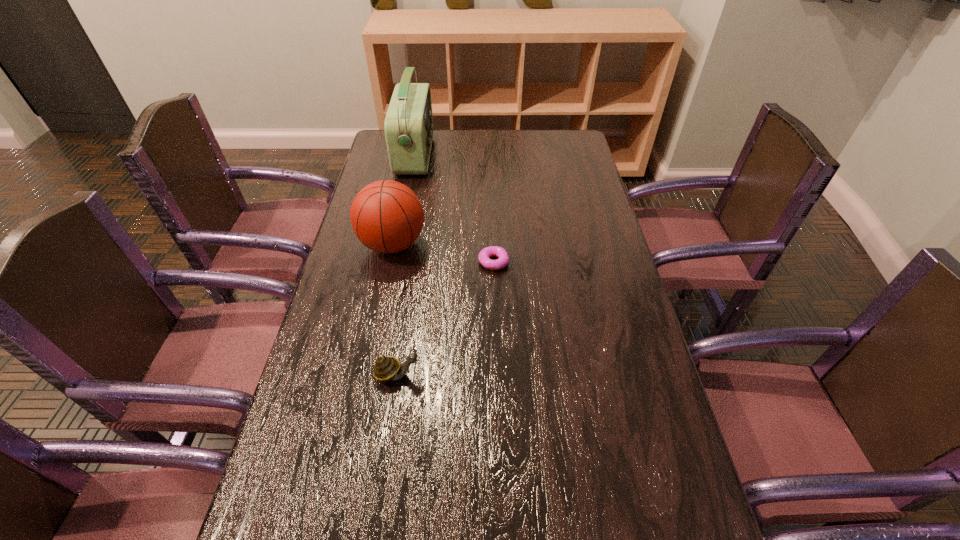
At what (x,y) coordinates should I click in order to perform the action: click on blank region between the doughnut and the basketball. Please return your answer as a coordinate pair (x, y). The width and height of the screenshot is (960, 540). Looking at the image, I should click on (444, 253).

The height and width of the screenshot is (540, 960). Identify the location of blank region between the rightmost object and the radio receiver. (454, 209).

You are a GUI agent. You are given a task and a screenshot of the screen. Output one action in this format:
    pyautogui.click(x=<x>, y=<y>)
    Task: Click on the blank region between the snail and the third shortest object
    Image resolution: width=960 pixels, height=540 pixels.
    Given the screenshot: What is the action you would take?
    pyautogui.click(x=396, y=309)

Image resolution: width=960 pixels, height=540 pixels. I want to click on empty space that is in between the second tallest object and the rightmost object, so click(x=444, y=253).

Identify the location of unoccupied area between the second tallest object and the nearest object. (396, 309).

At what (x,y) coordinates should I click in order to perform the action: click on free space between the nearest object and the third shortest object. Please return your answer as a coordinate pair (x, y). The height and width of the screenshot is (540, 960). Looking at the image, I should click on (396, 309).

You are a GUI agent. You are given a task and a screenshot of the screen. Output one action in this format:
    pyautogui.click(x=<x>, y=<y>)
    Task: Click on the empty space that is in between the third shortest object and the second shortest object
    Image resolution: width=960 pixels, height=540 pixels.
    Given the screenshot: What is the action you would take?
    pyautogui.click(x=396, y=309)

Identify the location of vacant area that lies between the radio receiver and the doughnut. This screenshot has height=540, width=960. (454, 209).

Locate which object ranks in proximity to the tallest object. Please provide its 2D coordinates. Your answer should be formatted as a tuple, i.e. [(x, y)], where the tuple contains the x and y coordinates of a point satisfying the conditions above.

[(386, 216)]

Identify the location of the second closest object relative to the basketball. This screenshot has width=960, height=540. (408, 126).